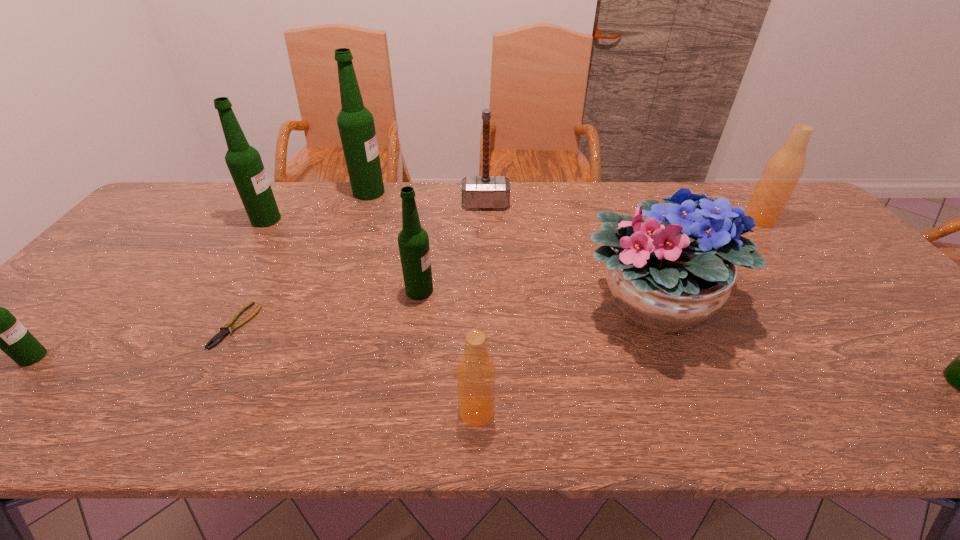
Locate an element on the screen. the third beer bottle from left to right is located at coordinates (355, 122).

This screenshot has width=960, height=540. In order to click on the third green beer bottle from right to left in this screenshot , I will do `click(355, 122)`.

Locate an element on the screen. The image size is (960, 540). the second object from left to right is located at coordinates (244, 162).

Image resolution: width=960 pixels, height=540 pixels. What are the coordinates of `the second green beer bottle from left to right` in the screenshot? It's located at (244, 162).

The image size is (960, 540). I want to click on brown hammer, so click(x=485, y=191).

At what (x,y) coordinates should I click in order to perform the action: click on the bigger tan beer bottle. Please return your answer as a coordinate pair (x, y). Looking at the image, I should click on (785, 167).

Locate an element on the screen. the right tan beer bottle is located at coordinates (785, 167).

Where is `the third nearest green beer bottle`? This screenshot has height=540, width=960. the third nearest green beer bottle is located at coordinates (413, 241).

Where is `the fourth beer bottle from right to left`? The image size is (960, 540). the fourth beer bottle from right to left is located at coordinates (413, 241).

The width and height of the screenshot is (960, 540). Identify the location of blue bouquet. (675, 270).